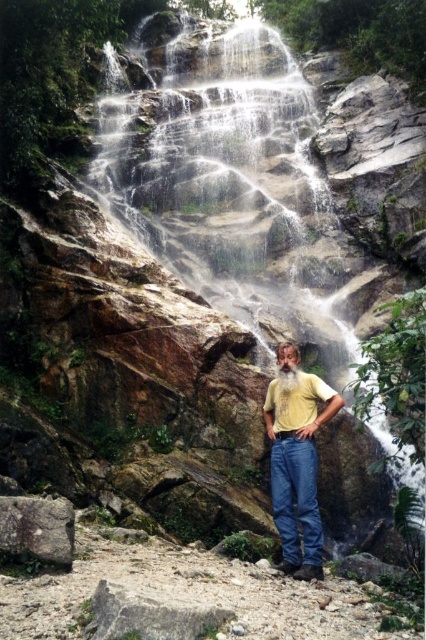
You are a photographer trying to capture the man in the yellow matte shirt at center. The camera is set up at the base of the waterfall. To ensure the man is in the center of your photo, should you adjust the camera to the left or right of the current position?

The yellow matte shirt at center is located at coordinates point [296,460]. Since the center of the image is typically at point [213,320], the shirt is positioned to the right and above the true center. To center the man in the photo, you should move the camera slightly to the left and down.

You are a photographer trying to capture the waterfall scene. You notice a point at coordinates (296, 460) in the image. What object is located at this point?

The point at coordinates (296, 460) corresponds to the yellow matte shirt at center.